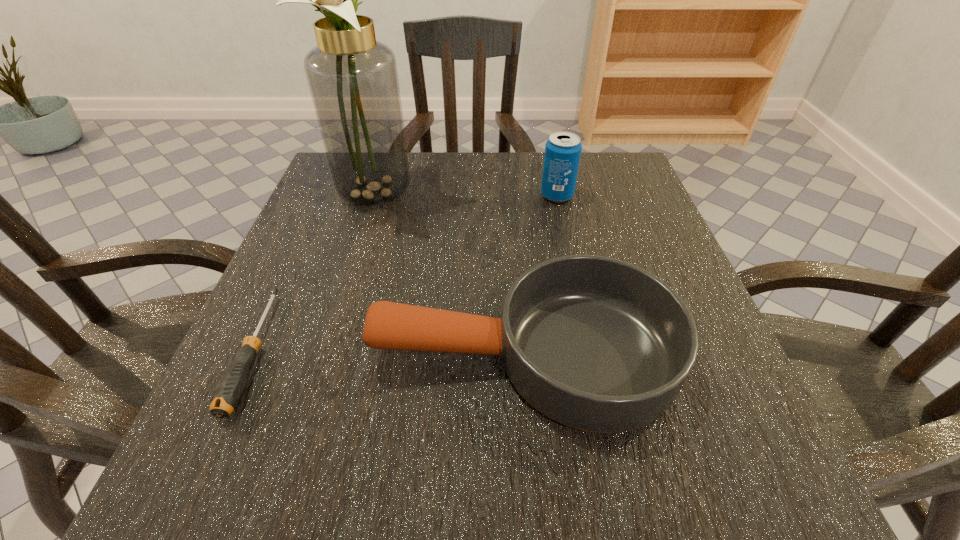
Identify the location of object present at the near right corner. This screenshot has width=960, height=540. (597, 344).

This screenshot has height=540, width=960. What are the coordinates of `blank space at the far edge of the desktop` in the screenshot? It's located at (461, 191).

Where is `free space at the left edge`? The width and height of the screenshot is (960, 540). free space at the left edge is located at coordinates (355, 212).

In the image, there is a desktop. What are the coordinates of `vacant space at the right edge` in the screenshot? It's located at (706, 408).

Identify the location of free spot at the far right corner of the desktop. (632, 185).

Image resolution: width=960 pixels, height=540 pixels. In order to click on free space at the near right corner of the desktop in this screenshot , I will do `click(716, 492)`.

Locate an element on the screen. Image resolution: width=960 pixels, height=540 pixels. vacant space in between the shortest object and the pan is located at coordinates (390, 353).

Where is `free spot between the third tallest object and the leftmost object`? free spot between the third tallest object and the leftmost object is located at coordinates (390, 353).

Where is `free spot between the third shortest object and the tallest object`? The height and width of the screenshot is (540, 960). free spot between the third shortest object and the tallest object is located at coordinates (469, 194).

The image size is (960, 540). Find the location of `unoccupied position between the tallest object and the third tallest object`. unoccupied position between the tallest object and the third tallest object is located at coordinates (453, 274).